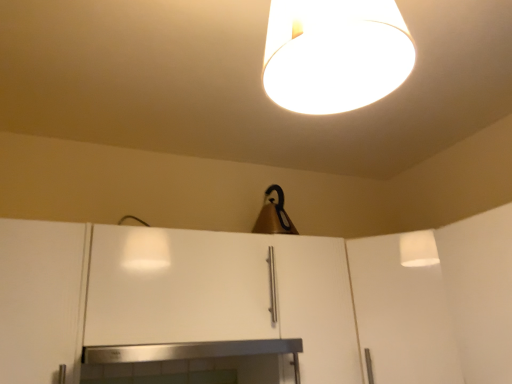
This screenshot has height=384, width=512. Describe the element at coordinates (193, 351) in the screenshot. I see `stainless steel fireplace at center` at that location.

Describe the element at coordinates (42, 299) in the screenshot. This screenshot has width=512, height=384. I see `white matte cabinet at left, which is the 1th cabinetry in left-to-right order` at that location.

How much space does white matte lampshade at upper center, which is the first lamp in front-to-back order, occupy vertically?

12.48 inches.

What do you see at coordinates (274, 215) in the screenshot? The height and width of the screenshot is (384, 512). I see `matte brown lampshade at upper center, which appears as the 1th lamp when viewed from the back` at bounding box center [274, 215].

Describe the element at coordinates (176, 286) in the screenshot. I see `white matte cabinet at center, which is counted as the 2th cabinetry, starting from the left` at that location.

Find the location of a particular element. This screenshot has width=512, height=384. stainless steel fireplace at center is located at coordinates (193, 351).

From the image's perspective, is white matte lampshade at upper center, the second lamp in the back-to-front sequence, located above white matte cabinet at center, which is counted as the 2th cabinetry, starting from the left?

Indeed, from the image's perspective, white matte lampshade at upper center, the second lamp in the back-to-front sequence, is shown above white matte cabinet at center, which is counted as the 2th cabinetry, starting from the left.

How much distance is there between white matte lampshade at upper center, the second lamp in the back-to-front sequence, and white matte cabinet at center, which is counted as the 2th cabinetry, starting from the left?

white matte lampshade at upper center, the second lamp in the back-to-front sequence, and white matte cabinet at center, which is counted as the 2th cabinetry, starting from the left, are 30.42 inches apart.

Locate an element on the screen. the 1st cabinetry positioned below the white matte lampshade at upper center, marked as the second lamp in a bottom-to-top arrangement (from the image's perspective) is located at coordinates (176, 286).

Can you confirm if stainless steel fireplace at center is taller than white matte cabinet at left, which is counted as the second cabinetry, starting from the right?

Incorrect, the height of stainless steel fireplace at center is not larger of that of white matte cabinet at left, which is counted as the second cabinetry, starting from the right.

From the image's perspective, is stainless steel fireplace at center located above white matte cabinet at left, which is the 1th cabinetry in left-to-right order?

Actually, stainless steel fireplace at center appears below white matte cabinet at left, which is the 1th cabinetry in left-to-right order, in the image.

From the image's perspective, which is above, white matte cabinet at center, which is counted as the 2th cabinetry, starting from the left, or matte brown lampshade at upper center, which is the second lamp in top-to-bottom order?

matte brown lampshade at upper center, which is the second lamp in top-to-bottom order, is shown above in the image.

Is white matte cabinet at center, which is counted as the 2th cabinetry, starting from the left, facing away from matte brown lampshade at upper center, which is counted as the 2th lamp, starting from the front?

No, white matte cabinet at center, which is counted as the 2th cabinetry, starting from the left, is not facing the opposite direction of matte brown lampshade at upper center, which is counted as the 2th lamp, starting from the front.

Considering the relative sizes of white matte cabinet at center, placed as the 1th cabinetry when sorted from right to left, and matte brown lampshade at upper center, which is counted as the 2th lamp, starting from the front, in the image provided, is white matte cabinet at center, placed as the 1th cabinetry when sorted from right to left, thinner than matte brown lampshade at upper center, which is counted as the 2th lamp, starting from the front,?

In fact, white matte cabinet at center, placed as the 1th cabinetry when sorted from right to left, might be wider than matte brown lampshade at upper center, which is counted as the 2th lamp, starting from the front.

Between point (184, 330) and point (278, 204), which one is positioned behind?

Point (278, 204)

Which object is positioned more to the left, white matte lampshade at upper center, marked as the second lamp in a bottom-to-top arrangement, or matte brown lampshade at upper center, which is the second lamp in top-to-bottom order?

white matte lampshade at upper center, marked as the second lamp in a bottom-to-top arrangement.

Is white matte lampshade at upper center, which is the first lamp in front-to-back order, oriented towards matte brown lampshade at upper center, which is the second lamp in top-to-bottom order?

No.

Is white matte lampshade at upper center, the second lamp in the back-to-front sequence, inside the boundaries of matte brown lampshade at upper center, which is counted as the 2th lamp, starting from the front, or outside?

white matte lampshade at upper center, the second lamp in the back-to-front sequence, is located beyond the bounds of matte brown lampshade at upper center, which is counted as the 2th lamp, starting from the front.

Which is in front, white matte lampshade at upper center, which is the first lamp in front-to-back order, or matte brown lampshade at upper center, which is counted as the 2th lamp, starting from the front?

white matte lampshade at upper center, which is the first lamp in front-to-back order, is in front.

How far apart are matte brown lampshade at upper center, which is the second lamp in top-to-bottom order, and white matte cabinet at left, which is the 1th cabinetry in left-to-right order?

matte brown lampshade at upper center, which is the second lamp in top-to-bottom order, is 32.83 inches away from white matte cabinet at left, which is the 1th cabinetry in left-to-right order.

Does matte brown lampshade at upper center, which appears as the 1th lamp when viewed from the back, have a greater width compared to white matte cabinet at left, which is counted as the second cabinetry, starting from the right?

No.

Considering the relative positions of matte brown lampshade at upper center, which appears as the 1th lamp when ordered from the bottom, and white matte cabinet at left, which is the 1th cabinetry in left-to-right order, in the image provided, is matte brown lampshade at upper center, which appears as the 1th lamp when ordered from the bottom, to the left of white matte cabinet at left, which is the 1th cabinetry in left-to-right order, from the viewer's perspective?

In fact, matte brown lampshade at upper center, which appears as the 1th lamp when ordered from the bottom, is to the right of white matte cabinet at left, which is the 1th cabinetry in left-to-right order.

Considering the relative sizes of matte brown lampshade at upper center, which appears as the 1th lamp when ordered from the bottom, and white matte cabinet at left, which is counted as the second cabinetry, starting from the right, in the image provided, is matte brown lampshade at upper center, which appears as the 1th lamp when ordered from the bottom, shorter than white matte cabinet at left, which is counted as the second cabinetry, starting from the right,?

Yes, matte brown lampshade at upper center, which appears as the 1th lamp when ordered from the bottom, is shorter than white matte cabinet at left, which is counted as the second cabinetry, starting from the right.

Is white matte cabinet at center, placed as the 1th cabinetry when sorted from right to left, looking in the opposite direction of white matte cabinet at left, which is the 1th cabinetry in left-to-right order?

No, white matte cabinet at left, which is the 1th cabinetry in left-to-right order, is not at the back of white matte cabinet at center, placed as the 1th cabinetry when sorted from right to left.

How different are the orientations of white matte cabinet at center, placed as the 1th cabinetry when sorted from right to left, and white matte cabinet at left, which is counted as the second cabinetry, starting from the right, in degrees?

0.568 degrees separate the facing orientations of white matte cabinet at center, placed as the 1th cabinetry when sorted from right to left, and white matte cabinet at left, which is counted as the second cabinetry, starting from the right.

Between white matte cabinet at center, which is counted as the 2th cabinetry, starting from the left, and white matte cabinet at left, which is the 1th cabinetry in left-to-right order, which one has more height?

white matte cabinet at left, which is the 1th cabinetry in left-to-right order, is taller.

Consider the image. Measure the distance from white matte cabinet at center, which is counted as the 2th cabinetry, starting from the left, to white matte cabinet at left, which is counted as the second cabinetry, starting from the right.

A distance of 8.10 inches exists between white matte cabinet at center, which is counted as the 2th cabinetry, starting from the left, and white matte cabinet at left, which is counted as the second cabinetry, starting from the right.

Based on the photo, is matte brown lampshade at upper center, which is counted as the 2th lamp, starting from the front, positioned with its back to white matte lampshade at upper center, marked as the second lamp in a bottom-to-top arrangement?

matte brown lampshade at upper center, which is counted as the 2th lamp, starting from the front, does not have its back to white matte lampshade at upper center, marked as the second lamp in a bottom-to-top arrangement.

Between matte brown lampshade at upper center, which is counted as the 2th lamp, starting from the front, and white matte lampshade at upper center, which is the first lamp in front-to-back order, which one is positioned behind?

Positioned behind is matte brown lampshade at upper center, which is counted as the 2th lamp, starting from the front.

Would you say matte brown lampshade at upper center, which appears as the 1th lamp when viewed from the back, is inside or outside white matte lampshade at upper center, marked as the second lamp in a bottom-to-top arrangement?

matte brown lampshade at upper center, which appears as the 1th lamp when viewed from the back, cannot be found inside white matte lampshade at upper center, marked as the second lamp in a bottom-to-top arrangement.

Locate an element on the screen. lamp behind the white matte lampshade at upper center, marked as the second lamp in a bottom-to-top arrangement is located at coordinates (274, 215).

This screenshot has height=384, width=512. In order to click on cabinetry that is the 1st object to the left of the white matte lampshade at upper center, marked as the second lamp in a bottom-to-top arrangement, starting at the anchor in this screenshot , I will do `click(176, 286)`.

Identify the location of fireplace located underneath the white matte cabinet at left, which is the 1th cabinetry in left-to-right order (from a real-world perspective). The width and height of the screenshot is (512, 384). (193, 351).

Which object lies further to the anchor point white matte lampshade at upper center, which is the first lamp in front-to-back order, matte brown lampshade at upper center, which is counted as the 2th lamp, starting from the front, or white matte cabinet at center, which is counted as the 2th cabinetry, starting from the left?

matte brown lampshade at upper center, which is counted as the 2th lamp, starting from the front, is further to white matte lampshade at upper center, which is the first lamp in front-to-back order.

Looking at the image, which one is located closer to white matte cabinet at center, placed as the 1th cabinetry when sorted from right to left, white matte lampshade at upper center, the second lamp in the back-to-front sequence, or white matte cabinet at left, which is the 1th cabinetry in left-to-right order?

Among the two, white matte cabinet at left, which is the 1th cabinetry in left-to-right order, is located nearer to white matte cabinet at center, placed as the 1th cabinetry when sorted from right to left.

Consider the image. From the image, which object appears to be nearer to white matte lampshade at upper center, which ranks as the 1th lamp in top-to-bottom order, stainless steel fireplace at center or matte brown lampshade at upper center, which is the second lamp in top-to-bottom order?

stainless steel fireplace at center.

Estimate the real-world distances between objects in this image. Which object is closer to stainless steel fireplace at center, white matte cabinet at left, which is counted as the second cabinetry, starting from the right, or matte brown lampshade at upper center, which appears as the 1th lamp when viewed from the back?

white matte cabinet at left, which is counted as the second cabinetry, starting from the right, is closer to stainless steel fireplace at center.

When comparing their distances from white matte cabinet at center, which is counted as the 2th cabinetry, starting from the left, does white matte cabinet at left, which is counted as the second cabinetry, starting from the right, or matte brown lampshade at upper center, which is counted as the 2th lamp, starting from the front, seem further?

matte brown lampshade at upper center, which is counted as the 2th lamp, starting from the front.

When comparing their distances from white matte cabinet at center, which is counted as the 2th cabinetry, starting from the left, does stainless steel fireplace at center or matte brown lampshade at upper center, which appears as the 1th lamp when ordered from the bottom, seem closer?

stainless steel fireplace at center.

Estimate the real-world distances between objects in this image. Which object is closer to white matte cabinet at left, which is the 1th cabinetry in left-to-right order, white matte cabinet at center, which is counted as the 2th cabinetry, starting from the left, or stainless steel fireplace at center?

Based on the image, white matte cabinet at center, which is counted as the 2th cabinetry, starting from the left, appears to be nearer to white matte cabinet at left, which is the 1th cabinetry in left-to-right order.

From the picture: Looking at the image, which one is located closer to stainless steel fireplace at center, matte brown lampshade at upper center, which appears as the 1th lamp when viewed from the back, or white matte cabinet at center, placed as the 1th cabinetry when sorted from right to left?

white matte cabinet at center, placed as the 1th cabinetry when sorted from right to left, is closer to stainless steel fireplace at center.

Find the location of `fireplace between white matte lampshade at upper center, marked as the second lamp in a bottom-to-top arrangement, and matte brown lampshade at upper center, which appears as the 1th lamp when viewed from the back, in the front-back direction`. fireplace between white matte lampshade at upper center, marked as the second lamp in a bottom-to-top arrangement, and matte brown lampshade at upper center, which appears as the 1th lamp when viewed from the back, in the front-back direction is located at coordinates tap(193, 351).

Where is `cabinetry between white matte cabinet at left, which is the 1th cabinetry in left-to-right order, and stainless steel fireplace at center from left to right`? The image size is (512, 384). cabinetry between white matte cabinet at left, which is the 1th cabinetry in left-to-right order, and stainless steel fireplace at center from left to right is located at coordinates (176, 286).

Where is `fireplace between white matte cabinet at left, which is counted as the second cabinetry, starting from the right, and matte brown lampshade at upper center, which is the second lamp in top-to-bottom order, from front to back`? The image size is (512, 384). fireplace between white matte cabinet at left, which is counted as the second cabinetry, starting from the right, and matte brown lampshade at upper center, which is the second lamp in top-to-bottom order, from front to back is located at coordinates (193, 351).

Where is `cabinetry between stainless steel fireplace at center and matte brown lampshade at upper center, which is counted as the 2th lamp, starting from the front, in the front-back direction`? cabinetry between stainless steel fireplace at center and matte brown lampshade at upper center, which is counted as the 2th lamp, starting from the front, in the front-back direction is located at coordinates (176, 286).